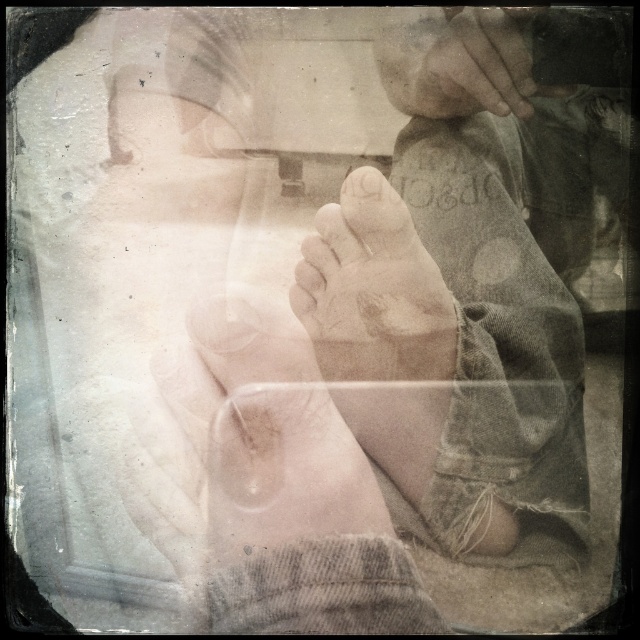
Based on the scene description, where is the smooth skin foot at center located in the image?

The smooth skin foot at center is located at point [369,272].

You are a photographer analyzing the double exposure image. You notice a point at coordinates (275, 436). Based on the scene description, what does this point most likely represent?

The point at coordinates (275, 436) corresponds to the smooth skin hand at center.

Based on the scene described, which object, the smooth skin foot at center or the smooth skin toe at center, has a greater width?

The smooth skin foot at center is wider than the smooth skin toe at center.